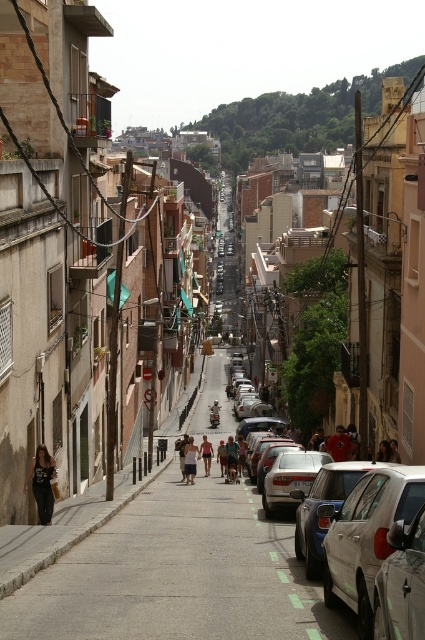
Can you confirm if satin white car at right is bigger than dark gray fabric pants at lower left?

Yes.

What do you see at coordinates (367, 536) in the screenshot? I see `satin white car at right` at bounding box center [367, 536].

At what (x,y) coordinates should I click in order to perform the action: click on satin white car at right. Please return your answer as a coordinate pair (x, y). The image size is (425, 640). Looking at the image, I should click on (367, 536).

Does satin silver sedan at center appear under white cotton shorts at center?

Incorrect, satin silver sedan at center is not positioned below white cotton shorts at center.

Is point (323, 452) behind point (212, 452)?

No, (323, 452) is closer to viewer.

Locate an element on the screen. This screenshot has height=640, width=425. satin silver sedan at center is located at coordinates (289, 477).

Which is more to the right, green leafy hillside at upper center or dark blue jeans at center?

green leafy hillside at upper center is more to the right.

Does green leafy hillside at upper center appear under dark blue jeans at center?

Actually, green leafy hillside at upper center is above dark blue jeans at center.

Is point (223, 116) farther from viewer compared to point (340, 458)?

Yes, it is.

You are a GUI agent. You are given a task and a screenshot of the screen. Output one action in this format:
    pyautogui.click(x=<x>, y=<y>)
    Task: Click on the green leafy hillside at upper center
    
    Given the screenshot: What is the action you would take?
    pyautogui.click(x=297, y=116)